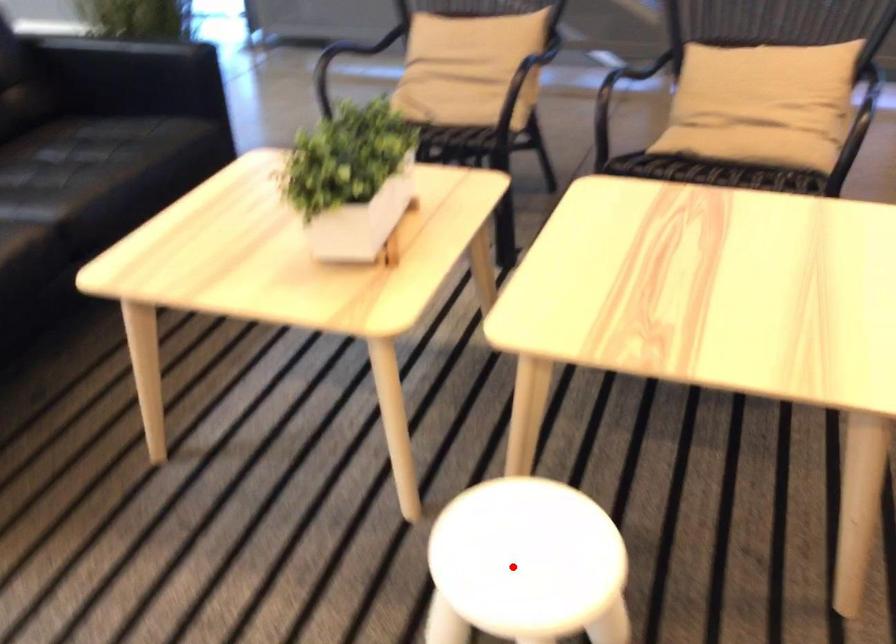
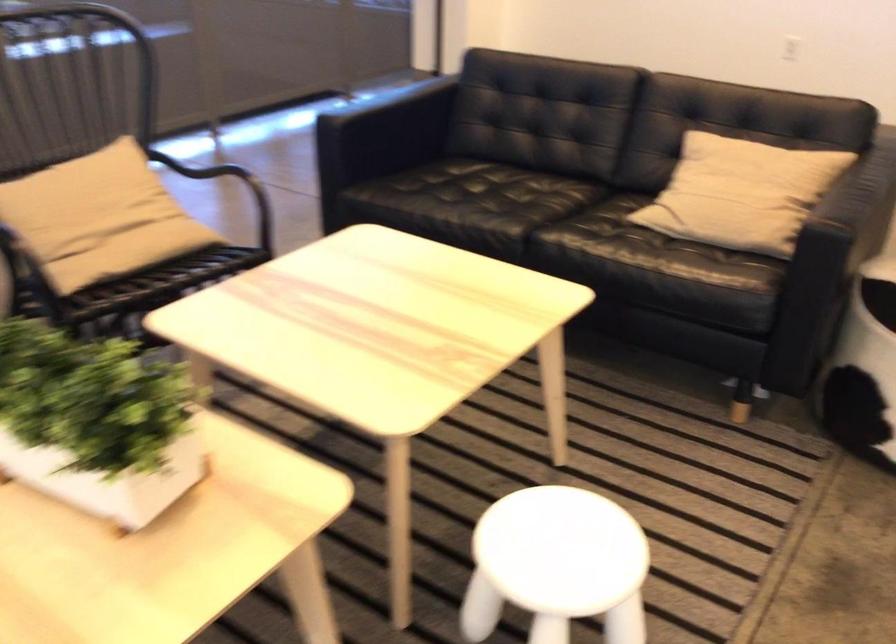
Question: I am providing you with two images of the same scene from different viewpoints. A red point is marked on the first image. At the location where the point appears in image 1, is it still visible in image 2?

Choices:
 (A) Yes
 (B) No

Answer: (A)